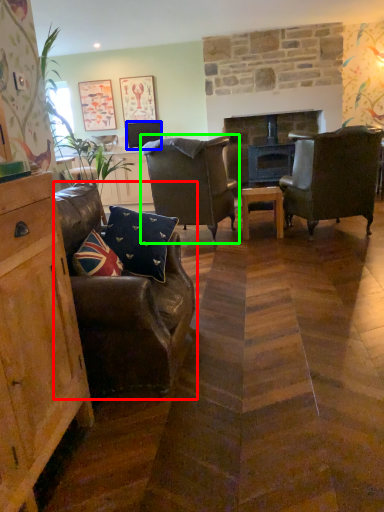
Question: Which is nearer to the chair (highlighted by a red box)? television (highlighted by a blue box) or chair (highlighted by a green box).

Choices:
 (A) television
 (B) chair

Answer: (B)